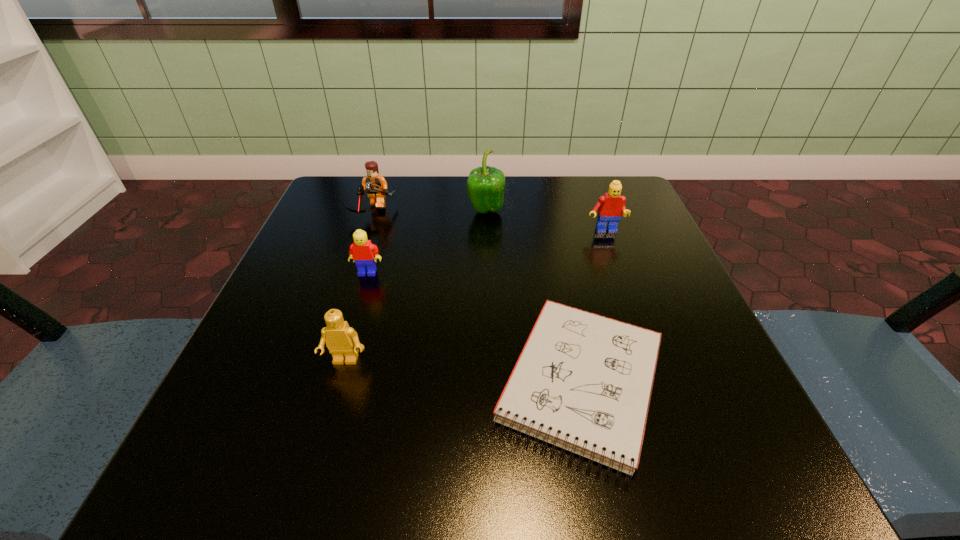
Locate an element on the screen. The width and height of the screenshot is (960, 540). the tallest object is located at coordinates (485, 186).

You are a GUI agent. You are given a task and a screenshot of the screen. Output one action in this format:
    pyautogui.click(x=<x>, y=<y>)
    Task: Click on the second farthest Lego
    Image resolution: width=960 pixels, height=540 pixels.
    Given the screenshot: What is the action you would take?
    pyautogui.click(x=610, y=206)

Where is `the rightmost Lego`? the rightmost Lego is located at coordinates (610, 206).

This screenshot has height=540, width=960. Identify the location of the farthest Lego. (376, 186).

Locate an element on the screen. the nearest Lego is located at coordinates (342, 341).

Identify the location of the second nearest Lego. The width and height of the screenshot is (960, 540). (362, 251).

The width and height of the screenshot is (960, 540). Find the location of `the shortest object`. the shortest object is located at coordinates (583, 382).

Locate an element on the screen. Image resolution: width=960 pixels, height=540 pixels. free space located 0.130m on the right of the tallest object is located at coordinates (563, 211).

Find the location of a particular element. Image resolution: width=960 pixels, height=540 pixels. vacant space situated on the front-facing side of the fourth nearest object is located at coordinates (639, 327).

In order to click on free space located 0.090m holding a crossbow in the hands of the farthest Lego in this screenshot , I will do `click(359, 249)`.